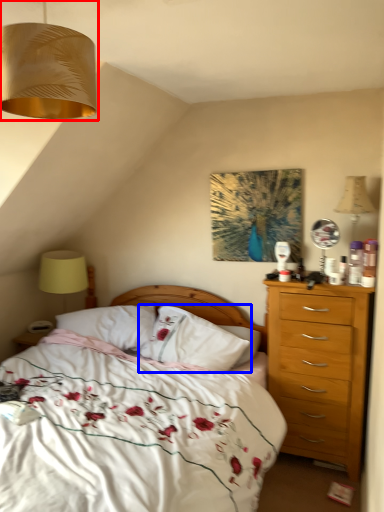
Question: Among these objects, which one is nearest to the camera, lamp (highlighted by a red box) or pillow (highlighted by a blue box)?

Choices:
 (A) lamp
 (B) pillow

Answer: (A)